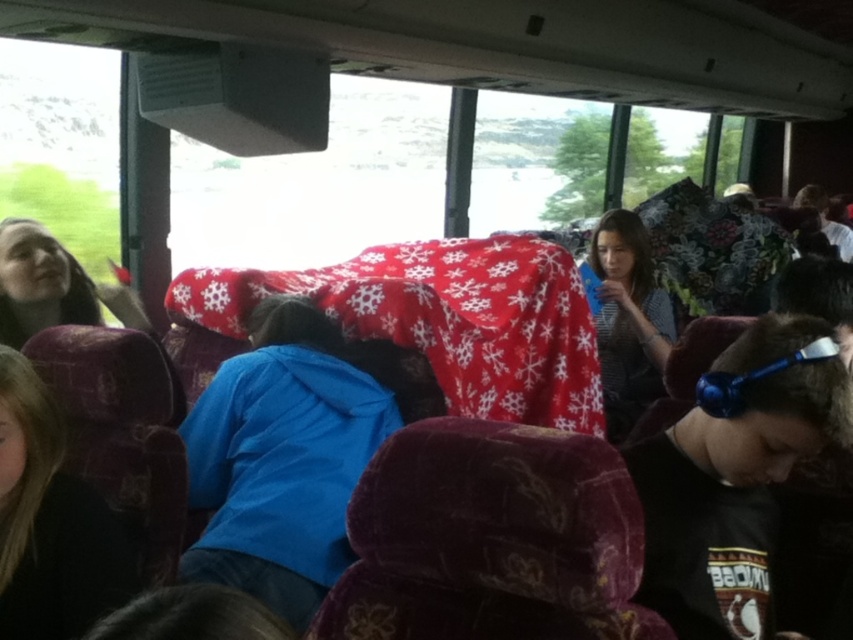
You are a passenger on a bus and need to reach your destination. You notice a blue fleece jacket at center and a dark brown leather jacket at lower left. Which jacket is closer to the aisle if the aisle is on the right side of the bus?

The blue fleece jacket at center is positioned on the right side of dark brown leather jacket at lower left, so it is closer to the aisle on the right side of the bus.

Looking at this image, you are a bus passenger who wants to place a 15 cm wide book on the seat between the blue fleece jacket at center and the blue metallic headphones at lower right. Can the book fit there?

The blue fleece jacket at center is wider than the blue metallic headphones at lower right. Since the jacket is wider, the space between them might be limited. However, without exact measurements of the seat or the distance between the objects, it is uncertain if the 15 cm wide book will fit. Consider checking the available space physically.